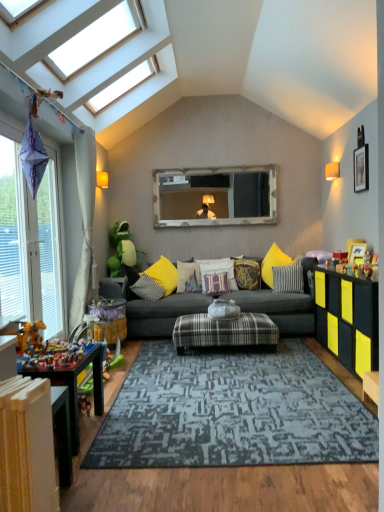
Question: Is beige fabric curtain at left at the right side of wooden picture frame at right, arranged as the 1th picture frame when viewed from the left?

Choices:
 (A) no
 (B) yes

Answer: (A)

Question: Is beige fabric curtain at left in front of wooden picture frame at right, arranged as the 1th picture frame when viewed from the left?

Choices:
 (A) yes
 (B) no

Answer: (B)

Question: From a real-world perspective, is beige fabric curtain at left located higher than wooden picture frame at right, which is the 2th picture frame from right to left?

Choices:
 (A) no
 (B) yes

Answer: (B)

Question: From the image's perspective, does beige fabric curtain at left appear higher than wooden picture frame at right, which ranks as the second picture frame in top-to-bottom order?

Choices:
 (A) yes
 (B) no

Answer: (A)

Question: Is beige fabric curtain at left turned away from wooden picture frame at right, arranged as the 1th picture frame when viewed from the left?

Choices:
 (A) yes
 (B) no

Answer: (B)

Question: From a real-world perspective, relative to beige fabric curtain at left, is wooden frame mirror at center vertically above or below?

Choices:
 (A) above
 (B) below

Answer: (A)

Question: Considering the positions of wooden frame mirror at center and beige fabric curtain at left in the image, is wooden frame mirror at center wider or thinner than beige fabric curtain at left?

Choices:
 (A) thin
 (B) wide

Answer: (A)

Question: From the image's perspective, relative to beige fabric curtain at left, is wooden frame mirror at center above or below?

Choices:
 (A) above
 (B) below

Answer: (A)

Question: From their relative heights in the image, would you say wooden frame mirror at center is taller or shorter than beige fabric curtain at left?

Choices:
 (A) tall
 (B) short

Answer: (B)

Question: From the image's perspective, is beige fabric curtain at left above or below textured yellow pillow at center, which is the fifth pillow in right-to-left order?

Choices:
 (A) above
 (B) below

Answer: (A)

Question: Considering the positions of beige fabric curtain at left and textured yellow pillow at center, arranged as the 2th pillow when viewed from the left, in the image, is beige fabric curtain at left bigger or smaller than textured yellow pillow at center, arranged as the 2th pillow when viewed from the left,?

Choices:
 (A) big
 (B) small

Answer: (A)

Question: Is point (82, 310) positioned closer to the camera than point (180, 290)?

Choices:
 (A) farther
 (B) closer

Answer: (B)

Question: Is beige fabric curtain at left taller or shorter than textured yellow pillow at center, arranged as the 2th pillow when viewed from the left?

Choices:
 (A) tall
 (B) short

Answer: (A)

Question: In terms of size, does white painted wood radiator at lower left appear bigger or smaller than wooden toy at lower left, acting as the 2th table starting from the back?

Choices:
 (A) big
 (B) small

Answer: (A)

Question: From the image's perspective, is white painted wood radiator at lower left positioned above or below wooden toy at lower left, which is counted as the second table, starting from the bottom?

Choices:
 (A) below
 (B) above

Answer: (A)